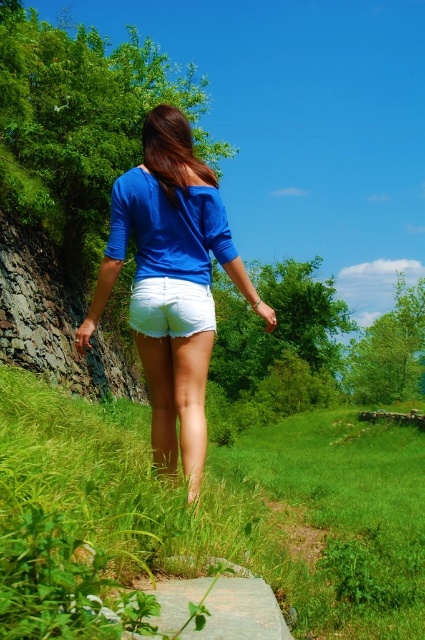
You are a photographer trying to capture the person in the image. You want to ensure the white cotton shorts at center are clearly visible against the background. Given the green grassy at lower left is part of the background, will the height difference between them affect the visibility?

The green grassy at lower left is much taller than the white cotton shorts at center, so the height difference might cause the white cotton shorts at center to be partially obscured by the taller grass, making them less visible in the photo.

You are standing at the point marked by the coordinates point (240, 500). Looking around, what do you see immediately in front of you based on the scene description?

The point (240, 500) corresponds to green grassy at lower left, so you would see the grassy area in front of you.